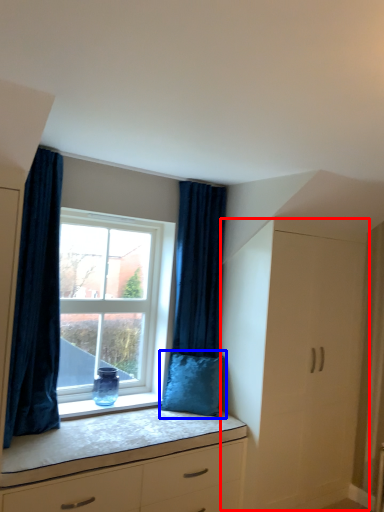
Question: Which of the following is the farthest to the observer, file cabinet (highlighted by a red box) or pillow (highlighted by a blue box)?

Choices:
 (A) file cabinet
 (B) pillow

Answer: (B)